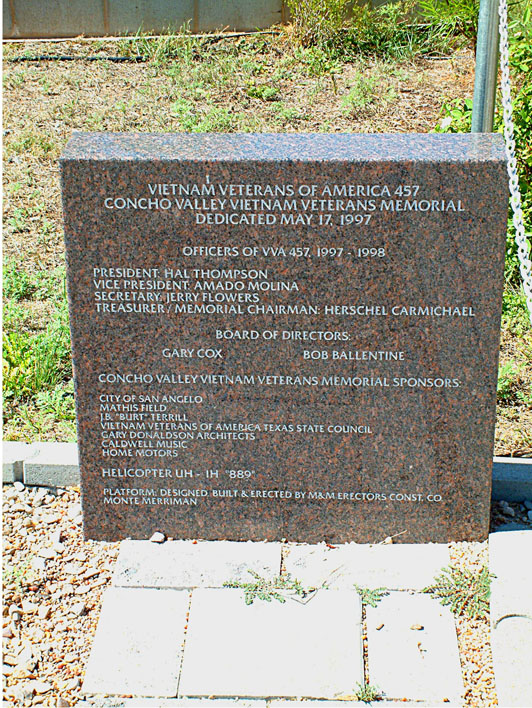
Find the location of a particular element. tile is located at coordinates (299, 631).